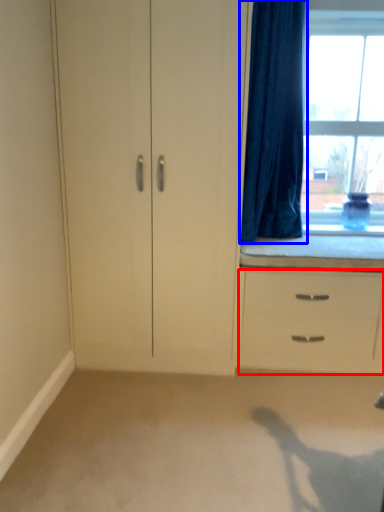
Question: Which object appears closest to the camera in this image, chest of drawers (highlighted by a red box) or curtain (highlighted by a blue box)?

Choices:
 (A) chest of drawers
 (B) curtain

Answer: (B)